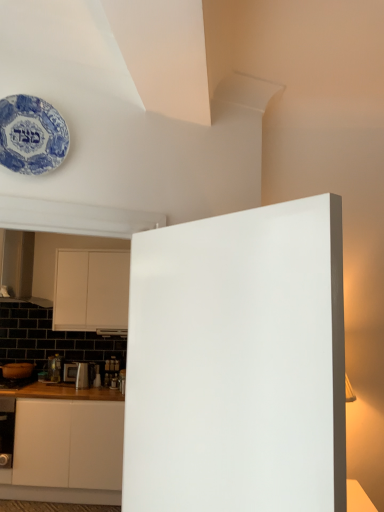
The image size is (384, 512). What do you see at coordinates (77, 374) in the screenshot?
I see `metallic silver toaster at lower left` at bounding box center [77, 374].

Locate an element on the screen. This screenshot has width=384, height=512. white matte cabinet at left is located at coordinates (x=91, y=291).

Is there a large distance between metallic silver toaster at lower left and white matte cabinet at left?

That's not correct — metallic silver toaster at lower left is a little close to white matte cabinet at left.

Is point (71, 368) closer to camera compared to point (76, 256)?

Yes, point (71, 368) is closer to viewer.

From a real-world perspective, relative to white matte cabinet at left, is metallic silver toaster at lower left vertically above or below?

metallic silver toaster at lower left is situated lower than white matte cabinet at left in the real world.

Is metallic silver toaster at lower left shorter than white matte cabinet at left?

Correct, metallic silver toaster at lower left is not as tall as white matte cabinet at left.

Is metallic silver toaster at lower left next to blue porcelain plate at upper left and touching it?

No, metallic silver toaster at lower left is not touching blue porcelain plate at upper left.

Considering the relative sizes of metallic silver toaster at lower left and blue porcelain plate at upper left in the image provided, is metallic silver toaster at lower left smaller than blue porcelain plate at upper left?

Incorrect, metallic silver toaster at lower left is not smaller in size than blue porcelain plate at upper left.

Is blue porcelain plate at upper left inside metallic silver toaster at lower left?

No, blue porcelain plate at upper left is located outside of metallic silver toaster at lower left.

Locate an element on the screen. The height and width of the screenshot is (512, 384). plate lying on the right of metallic silver toaster at lower left is located at coordinates (31, 135).

Looking at this image, is metallic silver toaster at lower left further to the viewer compared to white matte door at center?

That is True.

The image size is (384, 512). I want to click on door that appears above the metallic silver toaster at lower left (from the image's perspective), so click(x=238, y=362).

Is metallic silver toaster at lower left not within white matte door at center?

Yes, metallic silver toaster at lower left is located beyond the bounds of white matte door at center.

Is metallic silver toaster at lower left bigger than white matte door at center?

Actually, metallic silver toaster at lower left might be smaller than white matte door at center.

Between blue porcelain plate at upper left and white matte door at center, which one has larger size?

With larger size is white matte door at center.

Is blue porcelain plate at upper left thinner than white matte door at center?

Correct, the width of blue porcelain plate at upper left is less than that of white matte door at center.

From the picture: Would you say white matte door at center is part of blue porcelain plate at upper left's contents?

That's incorrect, white matte door at center is not inside blue porcelain plate at upper left.

Locate an element on the screen. The height and width of the screenshot is (512, 384). plate above the white matte door at center (from a real-world perspective) is located at coordinates (31, 135).

Locate an element on the screen. The height and width of the screenshot is (512, 384). plate behind the white matte door at center is located at coordinates (31, 135).

Is white matte door at center facing away from blue porcelain plate at upper left?

That's not correct — white matte door at center is not looking away from blue porcelain plate at upper left.

Does white matte door at center contain blue porcelain plate at upper left?

Definitely not — blue porcelain plate at upper left is not inside white matte door at center.

Can you confirm if white matte door at center is wider than blue porcelain plate at upper left?

Yes, white matte door at center is wider than blue porcelain plate at upper left.

From the image's perspective, relative to metallic silver toaster at lower left, is white matte door at center above or below?

Based on their image positions, white matte door at center is located above metallic silver toaster at lower left.

Based on their sizes in the image, would you say white matte door at center is bigger or smaller than metallic silver toaster at lower left?

Considering their sizes, white matte door at center takes up more space than metallic silver toaster at lower left.

Find the location of a particular element. Image resolution: width=384 pixels, height=512 pixels. door located in front of the metallic silver toaster at lower left is located at coordinates pos(238,362).

Is white matte door at center inside or outside of metallic silver toaster at lower left?

white matte door at center is spatially situated outside metallic silver toaster at lower left.

Is white matte cabinet at left touching blue porcelain plate at upper left?

No, white matte cabinet at left is not making contact with blue porcelain plate at upper left.

Identify the location of cabinetry below the blue porcelain plate at upper left (from the image's perspective). The height and width of the screenshot is (512, 384). (91, 291).

Which of these two, white matte cabinet at left or blue porcelain plate at upper left, is smaller?

blue porcelain plate at upper left is smaller.

How distant is white matte cabinet at left from blue porcelain plate at upper left?

white matte cabinet at left and blue porcelain plate at upper left are 9.38 feet apart from each other.

In order to click on appliance behind the white matte cabinet at left in this screenshot , I will do `click(77, 374)`.

You are a GUI agent. You are given a task and a screenshot of the screen. Output one action in this format:
    pyautogui.click(x=<x>, y=<y>)
    Task: Click on the appliance to the left of blue porcelain plate at upper left
    
    Given the screenshot: What is the action you would take?
    pyautogui.click(x=77, y=374)

Based on their spatial positions, is white matte door at center or metallic silver toaster at lower left further from white matte cabinet at left?

white matte door at center lies further to white matte cabinet at left than the other object.

Looking at the image, which one is located further to blue porcelain plate at upper left, metallic silver toaster at lower left or white matte door at center?

Based on the image, metallic silver toaster at lower left appears to be further to blue porcelain plate at upper left.

Based on their spatial positions, is metallic silver toaster at lower left or blue porcelain plate at upper left closer to white matte cabinet at left?

metallic silver toaster at lower left lies closer to white matte cabinet at left than the other object.

Estimate the real-world distances between objects in this image. Which object is closer to blue porcelain plate at upper left, white matte door at center or white matte cabinet at left?

Based on the image, white matte door at center appears to be nearer to blue porcelain plate at upper left.

Considering their positions, is white matte cabinet at left positioned further to white matte door at center than blue porcelain plate at upper left?

white matte cabinet at left is further to white matte door at center.

When comparing their distances from white matte cabinet at left, does white matte door at center or blue porcelain plate at upper left seem further?

Based on the image, white matte door at center appears to be further to white matte cabinet at left.

When comparing their distances from metallic silver toaster at lower left, does white matte door at center or blue porcelain plate at upper left seem further?

Based on the image, white matte door at center appears to be further to metallic silver toaster at lower left.

When comparing their distances from white matte cabinet at left, does blue porcelain plate at upper left or white matte door at center seem closer?

blue porcelain plate at upper left is closer to white matte cabinet at left.

Find the location of a particular element. The width and height of the screenshot is (384, 512). cabinetry between white matte door at center and metallic silver toaster at lower left along the z-axis is located at coordinates (91, 291).

The height and width of the screenshot is (512, 384). I want to click on cabinetry between blue porcelain plate at upper left and metallic silver toaster at lower left from front to back, so click(91, 291).

Identify the location of plate between white matte door at center and metallic silver toaster at lower left along the z-axis. (31, 135).

The width and height of the screenshot is (384, 512). In order to click on plate between white matte door at center and white matte cabinet at left in the front-back direction in this screenshot , I will do `click(31, 135)`.